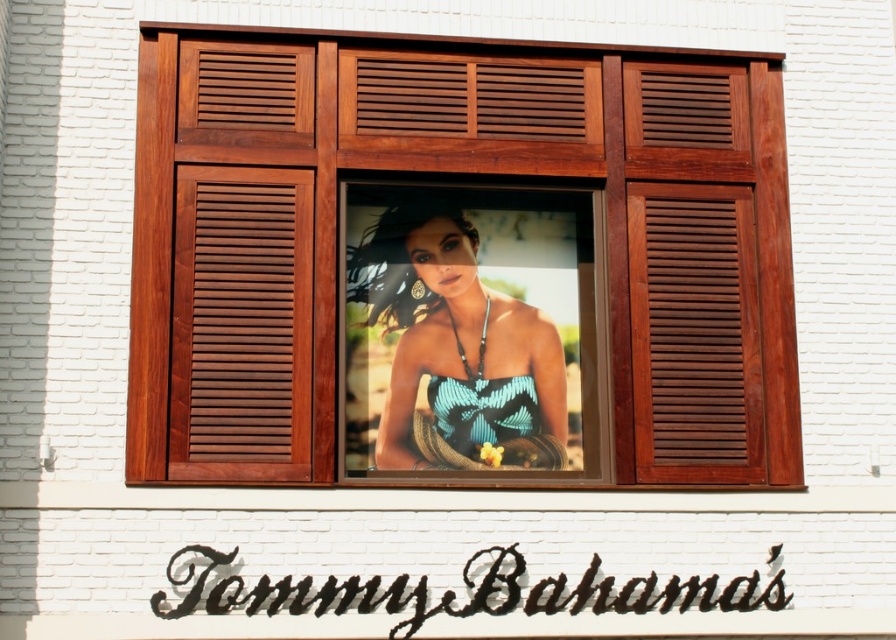
You are a customer looking at the Tommy Bahama store display. You see the mahogany wood shutter at right and the blue woven fabric dress at center. Which object is positioned higher in the scene?

The mahogany wood shutter at right is located above the blue woven fabric dress at center, so it is positioned higher in the scene.

You are a customer looking at a display in a Tommy Bahama store. You see two items displayed on a mannequin at the center of the window. The items are the matte blue fabric at center and the blue woven fabric dress at center. Which item is positioned higher on the mannequin?

The matte blue fabric at center is positioned higher on the mannequin than the blue woven fabric dress at center.